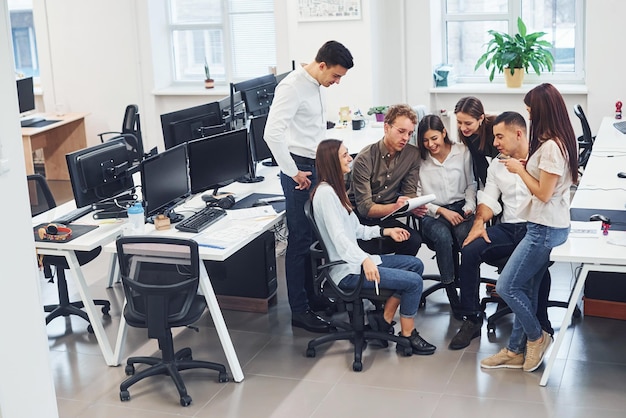
What are the coordinates of `windows` in the screenshot? It's located at (203, 46), (203, 16), (249, 5), (254, 40), (456, 35), (467, 3), (560, 17).